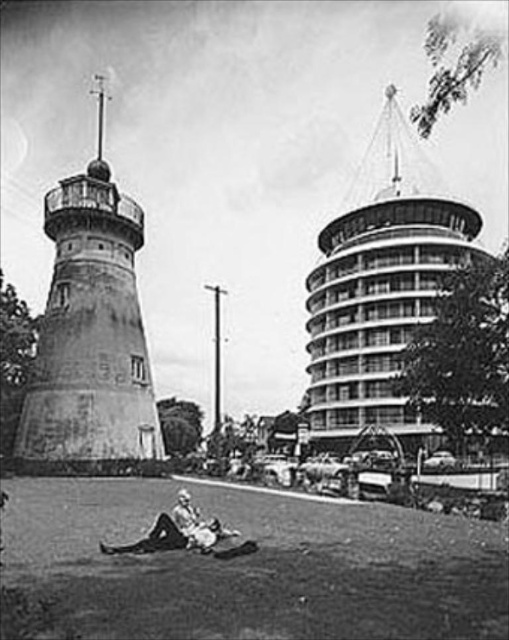
Question: Which point is closer to the camera?

Choices:
 (A) green grass at lower center
 (B) smooth concrete tower at upper right
 (C) rustic concrete water tower at left

Answer: (A)

Question: Can you confirm if green grass at lower center is positioned above light beige fabric at lower center?

Choices:
 (A) no
 (B) yes

Answer: (A)

Question: Estimate the real-world distances between objects in this image. Which object is closer to the smooth concrete tower at upper right?

Choices:
 (A) green grass at lower center
 (B) rustic concrete water tower at left

Answer: (B)

Question: Is green grass at lower center further to the viewer compared to light beige fabric at lower center?

Choices:
 (A) yes
 (B) no

Answer: (B)

Question: Is green grass at lower center bigger than rustic concrete water tower at left?

Choices:
 (A) no
 (B) yes

Answer: (A)

Question: Among these points, which one is farthest from the camera?

Choices:
 (A) (212, 529)
 (B) (139, 227)
 (C) (334, 316)
 (D) (383, 604)

Answer: (C)